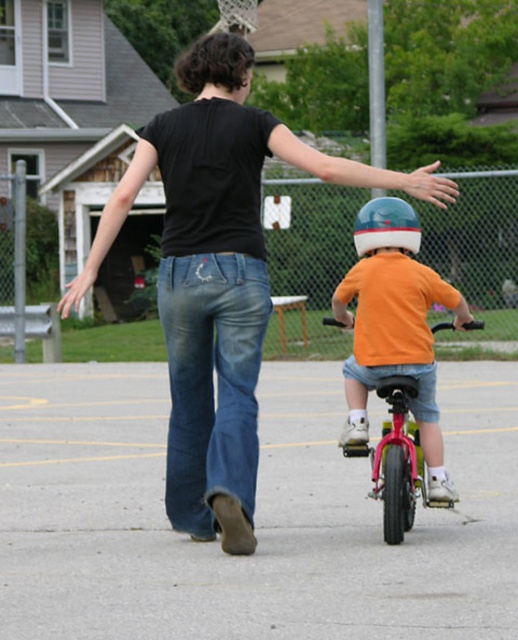
Question: Can you confirm if orange matte shirt at center is thinner than metallic pink bicycle at center?

Choices:
 (A) yes
 (B) no

Answer: (B)

Question: Is metallic pink bicycle at center in front of brushed metal basketball hoop at upper center?

Choices:
 (A) yes
 (B) no

Answer: (A)

Question: Does black matte shirt at upper center appear on the left side of metallic pink bicycle at center?

Choices:
 (A) no
 (B) yes

Answer: (B)

Question: Which point is closer to the camera?

Choices:
 (A) (161, 120)
 (B) (239, 10)
 (C) (365, 288)

Answer: (A)

Question: Among these points, which one is nearest to the camera?

Choices:
 (A) (226, 385)
 (B) (384, 196)
 (C) (250, 28)

Answer: (A)

Question: Among these points, which one is nearest to the camera?

Choices:
 (A) (375, 296)
 (B) (234, 17)
 (C) (383, 442)

Answer: (A)